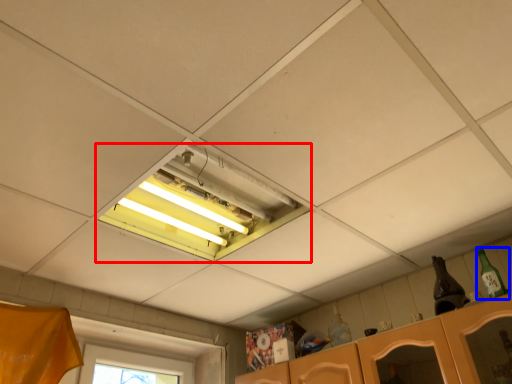
Question: Which object appears closest to the camera in this image, window (highlighted by a red box) or bottle (highlighted by a blue box)?

Choices:
 (A) window
 (B) bottle

Answer: (A)